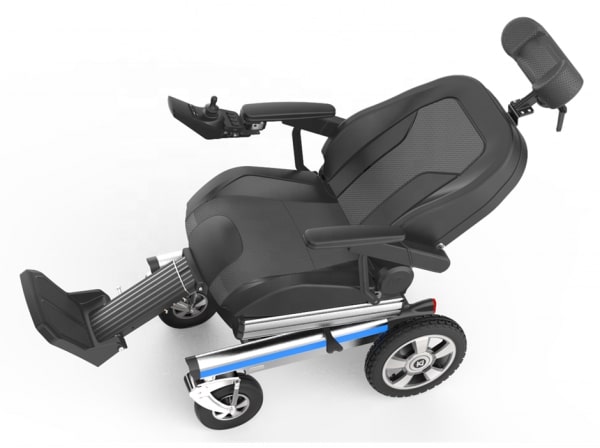
What are the coordinates of `right side of headrest` in the screenshot? It's located at (525, 32).